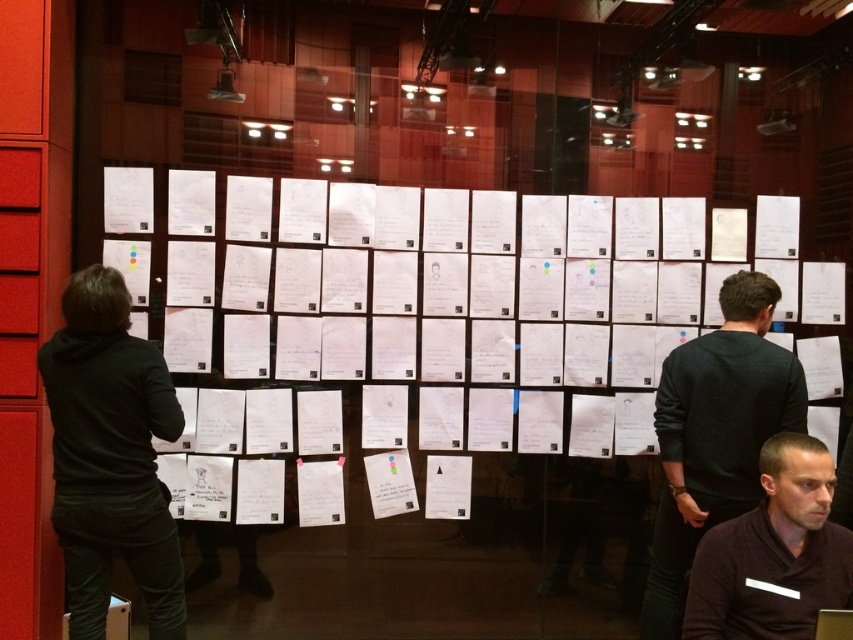
Can you confirm if white paper at center is thinner than dark brown shirt at center?

No.

Is white paper at center taller than dark brown shirt at center?

Indeed, white paper at center has a greater height compared to dark brown shirt at center.

You are a GUI agent. You are given a task and a screenshot of the screen. Output one action in this format:
    pyautogui.click(x=<x>, y=<y>)
    Task: Click on the white paper at center
    The image size is (853, 640).
    Given the screenshot: What is the action you would take?
    pyautogui.click(x=531, y=326)

Is black hoodie at left bigger than dark brown shirt at center?

Yes.

Can you confirm if black hoodie at left is positioned to the left of dark brown shirt at center?

Yes, black hoodie at left is to the left of dark brown shirt at center.

This screenshot has width=853, height=640. Find the location of `black hoodie at left`. black hoodie at left is located at coordinates (109, 456).

Who is positioned more to the right, white paper at center or black sweater at center?

Positioned to the right is black sweater at center.

Is point (263, 369) farther from camera compared to point (659, 540)?

That is True.

Where is `white paper at center`? The image size is (853, 640). white paper at center is located at coordinates (531, 326).